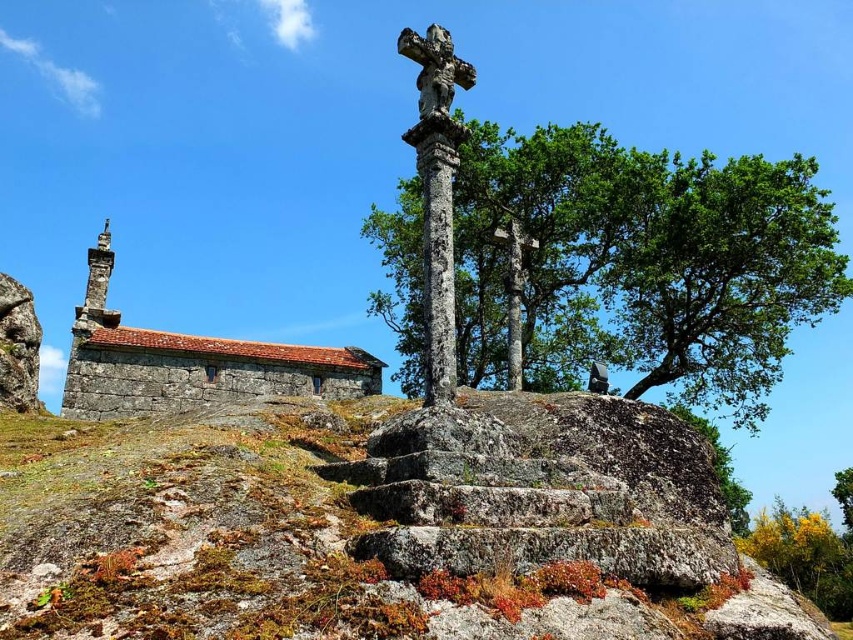
Question: Which point is closer to the camera?

Choices:
 (A) green rough bark tree at center
 (B) rustic stone church at left
 (C) yellow-green leaves at upper right
 (D) rusty stone steps at center

Answer: (D)

Question: Which is farther from the green rough bark tree at center?

Choices:
 (A) rusty stone steps at center
 (B) rustic stone church at left

Answer: (A)

Question: Does rusty stone steps at center appear on the right side of rustic stone church at left?

Choices:
 (A) yes
 (B) no

Answer: (A)

Question: Does rustic stone church at left appear over yellow-green leaves at upper right?

Choices:
 (A) no
 (B) yes

Answer: (B)

Question: Can you confirm if green rough bark tree at center is positioned to the right of yellow-green leaves at upper right?

Choices:
 (A) no
 (B) yes

Answer: (A)

Question: Which point is closer to the camera taking this photo?

Choices:
 (A) (770, 564)
 (B) (340, 632)
 (C) (479, 323)

Answer: (B)